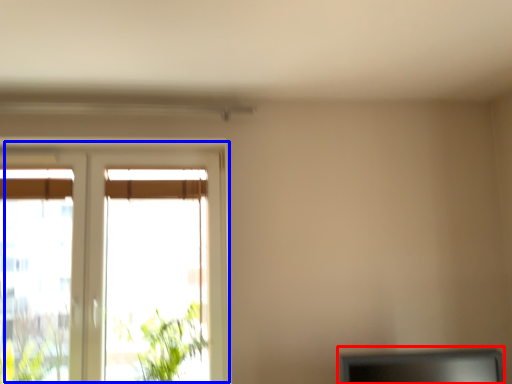
Question: Which point is further to the camera, computer monitor (highlighted by a red box) or window (highlighted by a blue box)?

Choices:
 (A) computer monitor
 (B) window

Answer: (B)